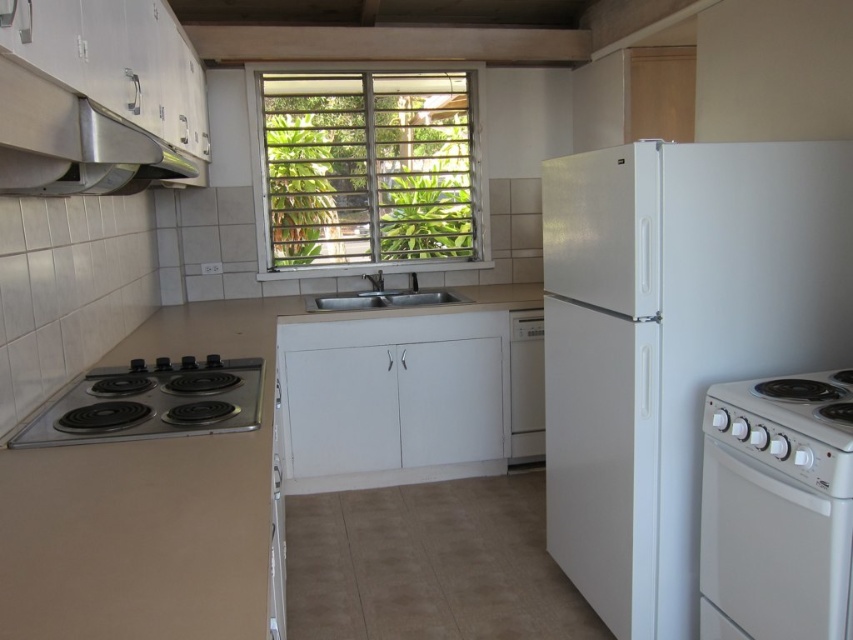
Can you confirm if white glossy electric stove at lower right is positioned to the right of white plastic dishwasher at center?

Correct, you'll find white glossy electric stove at lower right to the right of white plastic dishwasher at center.

Which is behind, point (709, 394) or point (543, 387)?

Point (543, 387)

I want to click on white glossy electric stove at lower right, so click(x=776, y=508).

Is white glossy electric stove at lower right above stainless steel exhaust hood at upper left?

No.

Is white glossy electric stove at lower right thinner than stainless steel exhaust hood at upper left?

Yes, white glossy electric stove at lower right is thinner than stainless steel exhaust hood at upper left.

Which is behind, point (784, 392) or point (51, 172)?

Point (784, 392)

Find the location of `white glossy electric stove at lower right`. white glossy electric stove at lower right is located at coordinates (776, 508).

Can you confirm if white glossy electric stove at lower right is smaller than white matte sink at center?

No.

Between point (708, 618) and point (366, 304), which one is positioned in front?

Point (708, 618) is in front.

The height and width of the screenshot is (640, 853). I want to click on white glossy electric stove at lower right, so click(x=776, y=508).